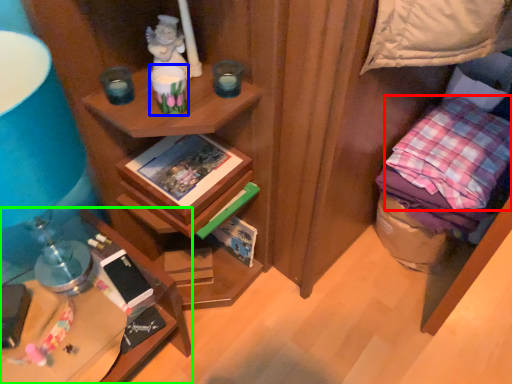
Question: Considering the real-world distances, which object is farthest from pillow (highlighted by a red box)? candle holder (highlighted by a blue box) or desk (highlighted by a green box)?

Choices:
 (A) candle holder
 (B) desk

Answer: (B)